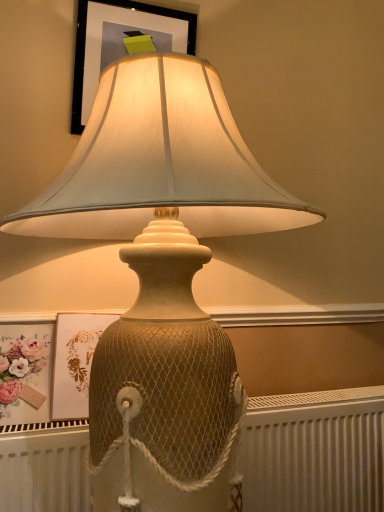
Find the location of `white textured radiator at lower center`. white textured radiator at lower center is located at coordinates (315, 451).

Describe the element at coordinates (75, 362) in the screenshot. Image resolution: width=384 pixels, height=512 pixels. I see `matte gold picture frame at upper center, which appears as the second picture frame when viewed from the top` at that location.

What is the approximate height of matte gold picture frame at upper center, the 1th picture frame from the bottom?

It is 9.81 inches.

This screenshot has height=512, width=384. What do you see at coordinates (120, 42) in the screenshot?
I see `matte black frame at upper center, which is the first picture frame from top to bottom` at bounding box center [120, 42].

The width and height of the screenshot is (384, 512). Identify the location of white textured radiator at lower center. (315, 451).

Is matte gold picture frame at upper center, the 1th picture frame from the bottom, placed right next to white textured radiator at lower center?

No, matte gold picture frame at upper center, the 1th picture frame from the bottom, is not with white textured radiator at lower center.

Can you confirm if matte gold picture frame at upper center, which appears as the second picture frame when viewed from the top, is thinner than white textured radiator at lower center?

Indeed, matte gold picture frame at upper center, which appears as the second picture frame when viewed from the top, has a lesser width compared to white textured radiator at lower center.

Is matte gold picture frame at upper center, the 1th picture frame from the bottom, oriented towards white textured radiator at lower center?

No, matte gold picture frame at upper center, the 1th picture frame from the bottom, is not oriented towards white textured radiator at lower center.

How different are the orientations of matte gold picture frame at upper center, the 1th picture frame from the bottom, and white textured radiator at lower center in degrees?

There is a 1.02-degree angle between the facing directions of matte gold picture frame at upper center, the 1th picture frame from the bottom, and white textured radiator at lower center.

Does matte floral print at lower left have a greater height compared to white textured radiator at lower center?

No.

In the scene shown: Is matte floral print at lower left not inside white textured radiator at lower center?

Yes, matte floral print at lower left is outside of white textured radiator at lower center.

Does matte floral print at lower left touch white textured radiator at lower center?

No.

Is white textured radiator at lower center at the back of matte floral print at lower left?

No.

Is matte gold picture frame at upper center, which appears as the second picture frame when viewed from the top, next to matte floral print at lower left and touching it?

Yes, matte gold picture frame at upper center, which appears as the second picture frame when viewed from the top, is with matte floral print at lower left.

From a real-world perspective, is matte gold picture frame at upper center, which appears as the second picture frame when viewed from the top, physically above matte floral print at lower left?

Yes, from a real-world perspective, matte gold picture frame at upper center, which appears as the second picture frame when viewed from the top, is over matte floral print at lower left

Considering the sizes of matte gold picture frame at upper center, the 1th picture frame from the bottom, and matte floral print at lower left in the image, is matte gold picture frame at upper center, the 1th picture frame from the bottom, taller or shorter than matte floral print at lower left?

matte gold picture frame at upper center, the 1th picture frame from the bottom, is taller than matte floral print at lower left.

Considering the positions of objects matte gold picture frame at upper center, the 1th picture frame from the bottom, and matte floral print at lower left in the image provided, who is more to the left, matte gold picture frame at upper center, the 1th picture frame from the bottom, or matte floral print at lower left?

matte floral print at lower left.

Is matte black frame at upper center, which is the first picture frame from top to bottom, positioned beyond the bounds of matte gold picture frame at upper center, the 1th picture frame from the bottom?

Indeed, matte black frame at upper center, which is the first picture frame from top to bottom, is completely outside matte gold picture frame at upper center, the 1th picture frame from the bottom.

Is the position of matte black frame at upper center, placed as the 2th picture frame when sorted from bottom to top, less distant than that of matte gold picture frame at upper center, which appears as the second picture frame when viewed from the top?

No, matte black frame at upper center, placed as the 2th picture frame when sorted from bottom to top, is behind matte gold picture frame at upper center, which appears as the second picture frame when viewed from the top.

Which object is thinner, matte black frame at upper center, placed as the 2th picture frame when sorted from bottom to top, or matte gold picture frame at upper center, which appears as the second picture frame when viewed from the top?

With smaller width is matte black frame at upper center, placed as the 2th picture frame when sorted from bottom to top.

Would you say matte black frame at upper center, placed as the 2th picture frame when sorted from bottom to top, is to the left or to the right of matte gold picture frame at upper center, which appears as the second picture frame when viewed from the top, in the picture?

matte black frame at upper center, placed as the 2th picture frame when sorted from bottom to top, is positioned on matte gold picture frame at upper center, which appears as the second picture frame when viewed from the top,'s right side.

Between matte black frame at upper center, which is the first picture frame from top to bottom, and matte floral print at lower left, which one is positioned in front?

matte floral print at lower left is closer to the camera.

In the scene shown: From the image's perspective, is matte black frame at upper center, which is the first picture frame from top to bottom, on top of matte floral print at lower left?

Yes, from the image's perspective, matte black frame at upper center, which is the first picture frame from top to bottom, is on top of matte floral print at lower left.

Is matte black frame at upper center, which is the first picture frame from top to bottom, at the right side of matte floral print at lower left?

Correct, you'll find matte black frame at upper center, which is the first picture frame from top to bottom, to the right of matte floral print at lower left.

Can you tell me how much matte black frame at upper center, which is the first picture frame from top to bottom, and matte floral print at lower left differ in facing direction?

The facing directions of matte black frame at upper center, which is the first picture frame from top to bottom, and matte floral print at lower left are 0.44 degrees apart.

Considering the relative positions of white textured radiator at lower center and matte black frame at upper center, placed as the 2th picture frame when sorted from bottom to top, in the image provided, is white textured radiator at lower center to the left of matte black frame at upper center, placed as the 2th picture frame when sorted from bottom to top, from the viewer's perspective?

Incorrect, white textured radiator at lower center is not on the left side of matte black frame at upper center, placed as the 2th picture frame when sorted from bottom to top.

From the image's perspective, does white textured radiator at lower center appear higher than matte black frame at upper center, placed as the 2th picture frame when sorted from bottom to top?

No, from the image's perspective, white textured radiator at lower center is not above matte black frame at upper center, placed as the 2th picture frame when sorted from bottom to top.

Where is `radiator located on the right of matte black frame at upper center, placed as the 2th picture frame when sorted from bottom to top`? radiator located on the right of matte black frame at upper center, placed as the 2th picture frame when sorted from bottom to top is located at coordinates (315, 451).

Is white textured radiator at lower center oriented away from matte black frame at upper center, which is the first picture frame from top to bottom?

white textured radiator at lower center does not have its back to matte black frame at upper center, which is the first picture frame from top to bottom.

Could matte black frame at upper center, placed as the 2th picture frame when sorted from bottom to top, be considered to be inside matte gold picture frame at upper center, which appears as the second picture frame when viewed from the top?

No, matte gold picture frame at upper center, which appears as the second picture frame when viewed from the top, does not contain matte black frame at upper center, placed as the 2th picture frame when sorted from bottom to top.

From a real-world perspective, which is physically below, matte gold picture frame at upper center, which appears as the second picture frame when viewed from the top, or matte black frame at upper center, which is the first picture frame from top to bottom?

From a 3D spatial view, matte gold picture frame at upper center, which appears as the second picture frame when viewed from the top, is below.

Which of these two, matte gold picture frame at upper center, the 1th picture frame from the bottom, or matte black frame at upper center, placed as the 2th picture frame when sorted from bottom to top, is smaller?

With smaller size is matte black frame at upper center, placed as the 2th picture frame when sorted from bottom to top.

From the image's perspective, is matte gold picture frame at upper center, the 1th picture frame from the bottom, located beneath matte black frame at upper center, placed as the 2th picture frame when sorted from bottom to top?

Yes, from the image's perspective, matte gold picture frame at upper center, the 1th picture frame from the bottom, is beneath matte black frame at upper center, placed as the 2th picture frame when sorted from bottom to top.

The image size is (384, 512). In order to click on picture frame that is the 1st object above the white textured radiator at lower center (from a real-world perspective) in this screenshot , I will do `click(75, 362)`.

Where is `radiator below the matte floral print at lower left (from a real-world perspective)`? The image size is (384, 512). radiator below the matte floral print at lower left (from a real-world perspective) is located at coordinates (315, 451).

From the picture: Estimate the real-world distances between objects in this image. Which object is closer to white textured radiator at lower center, matte floral print at lower left or matte black frame at upper center, which is the first picture frame from top to bottom?

matte floral print at lower left is positioned closer to the anchor white textured radiator at lower center.

Which object lies nearer to the anchor point white textured radiator at lower center, matte gold picture frame at upper center, the 1th picture frame from the bottom, or matte black frame at upper center, placed as the 2th picture frame when sorted from bottom to top?

Among the two, matte gold picture frame at upper center, the 1th picture frame from the bottom, is located nearer to white textured radiator at lower center.

Considering their positions, is white textured radiator at lower center positioned closer to matte black frame at upper center, which is the first picture frame from top to bottom, than matte floral print at lower left?

matte floral print at lower left is closer to matte black frame at upper center, which is the first picture frame from top to bottom.

Based on their spatial positions, is white textured radiator at lower center or matte black frame at upper center, placed as the 2th picture frame when sorted from bottom to top, closer to matte floral print at lower left?

Based on the image, white textured radiator at lower center appears to be nearer to matte floral print at lower left.

Looking at the image, which one is located further to matte gold picture frame at upper center, which appears as the second picture frame when viewed from the top, matte black frame at upper center, which is the first picture frame from top to bottom, or white textured radiator at lower center?

Among the two, matte black frame at upper center, which is the first picture frame from top to bottom, is located further to matte gold picture frame at upper center, which appears as the second picture frame when viewed from the top.

Estimate the real-world distances between objects in this image. Which object is further from white textured radiator at lower center, matte black frame at upper center, which is the first picture frame from top to bottom, or matte floral print at lower left?

matte black frame at upper center, which is the first picture frame from top to bottom, is further to white textured radiator at lower center.

Considering their positions, is matte floral print at lower left positioned closer to matte gold picture frame at upper center, which appears as the second picture frame when viewed from the top, than white textured radiator at lower center?

The object closer to matte gold picture frame at upper center, which appears as the second picture frame when viewed from the top, is matte floral print at lower left.

From the image, which object appears to be farther from matte floral print at lower left, matte gold picture frame at upper center, which appears as the second picture frame when viewed from the top, or matte black frame at upper center, placed as the 2th picture frame when sorted from bottom to top?

Based on the image, matte black frame at upper center, placed as the 2th picture frame when sorted from bottom to top, appears to be further to matte floral print at lower left.

Where is `picture frame between matte black frame at upper center, placed as the 2th picture frame when sorted from bottom to top, and white textured radiator at lower center from top to bottom`? This screenshot has width=384, height=512. picture frame between matte black frame at upper center, placed as the 2th picture frame when sorted from bottom to top, and white textured radiator at lower center from top to bottom is located at coordinates (75, 362).

Find the location of `picture frame between matte black frame at upper center, which is the first picture frame from top to bottom, and matte floral print at lower left in the up-down direction`. picture frame between matte black frame at upper center, which is the first picture frame from top to bottom, and matte floral print at lower left in the up-down direction is located at coordinates (75, 362).

The image size is (384, 512). Find the location of `flower between matte black frame at upper center, placed as the 2th picture frame when sorted from bottom to top, and white textured radiator at lower center from top to bottom`. flower between matte black frame at upper center, placed as the 2th picture frame when sorted from bottom to top, and white textured radiator at lower center from top to bottom is located at coordinates (21, 371).